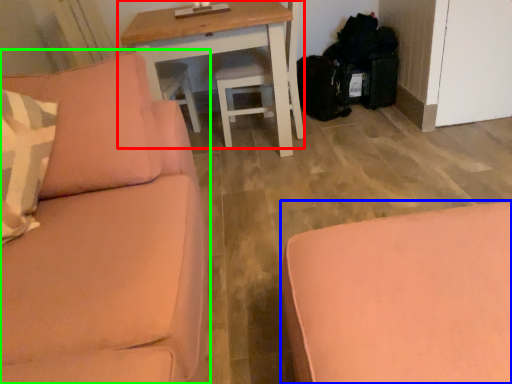
Question: Which object is positioned closest to table (highlighted by a red box)? Select from studio couch (highlighted by a blue box) and studio couch (highlighted by a green box).

Choices:
 (A) studio couch
 (B) studio couch

Answer: (B)